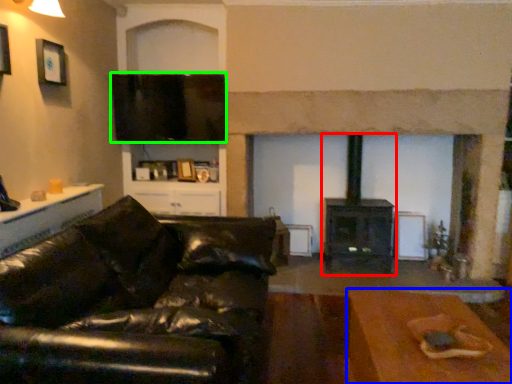
Question: Which is farther away from wood burning stove (highlighted by a red box)? table (highlighted by a blue box) or window screen (highlighted by a green box)?

Choices:
 (A) table
 (B) window screen

Answer: (A)